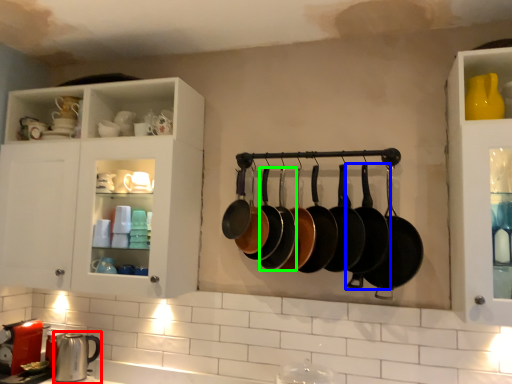
Question: Estimate the real-world distances between objects in this image. Which object is farther from appliance (highlighted by a red box), frying pan (highlighted by a blue box) or frying pan (highlighted by a green box)?

Choices:
 (A) frying pan
 (B) frying pan

Answer: (A)